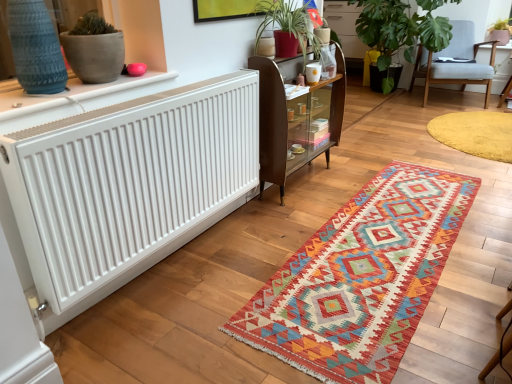
Locate an element on the screen. Image resolution: width=512 pixels, height=384 pixels. vacant space in between yellow plush rug at lower right, which is the 2th mat from bottom to top, and knitted woolen rug at center, the second mat in the top-to-bottom sequence is located at coordinates (460, 169).